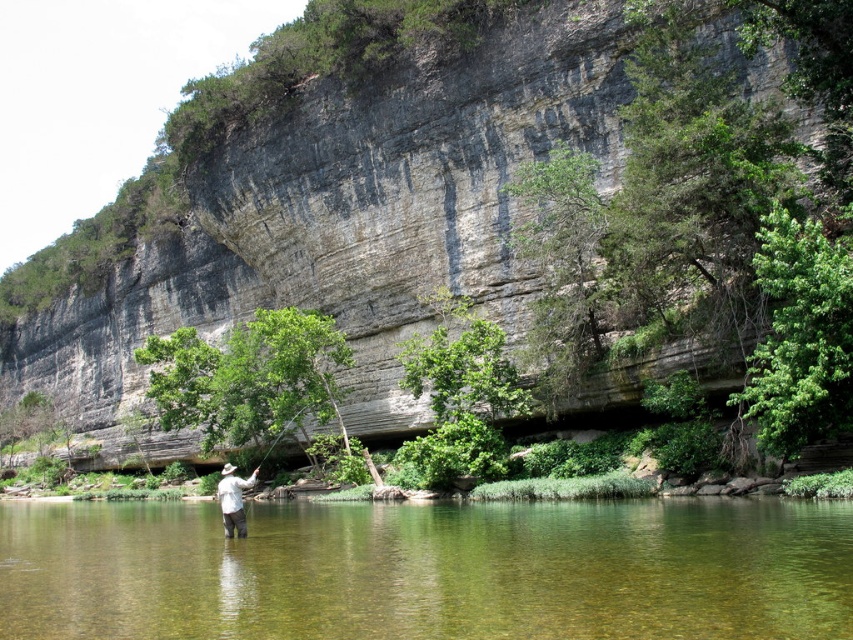
Is clear water at center below white matte shirt at center?

Incorrect, clear water at center is not positioned below white matte shirt at center.

Locate an element on the screen. clear water at center is located at coordinates (428, 570).

At what (x,y) coordinates should I click in order to perform the action: click on clear water at center. Please return your answer as a coordinate pair (x, y). Looking at the image, I should click on (428, 570).

Does gray rock cliff at upper center appear under white matte shirt at center?

No.

Can you confirm if gray rock cliff at upper center is smaller than white matte shirt at center?

Actually, gray rock cliff at upper center might be larger than white matte shirt at center.

You are a GUI agent. You are given a task and a screenshot of the screen. Output one action in this format:
    pyautogui.click(x=<x>, y=<y>)
    Task: Click on the gray rock cliff at upper center
    
    Given the screenshot: What is the action you would take?
    pyautogui.click(x=532, y=200)

Find the location of a particular element. gray rock cliff at upper center is located at coordinates pyautogui.click(x=532, y=200).

Based on the photo, does gray rock cliff at upper center have a lesser width compared to clear water at center?

Incorrect, gray rock cliff at upper center's width is not less than clear water at center's.

Can you confirm if gray rock cliff at upper center is positioned to the right of clear water at center?

No, gray rock cliff at upper center is not to the right of clear water at center.

What do you see at coordinates (532, 200) in the screenshot?
I see `gray rock cliff at upper center` at bounding box center [532, 200].

You are a GUI agent. You are given a task and a screenshot of the screen. Output one action in this format:
    pyautogui.click(x=<x>, y=<y>)
    Task: Click on the gray rock cliff at upper center
    The width and height of the screenshot is (853, 640).
    Given the screenshot: What is the action you would take?
    pyautogui.click(x=532, y=200)